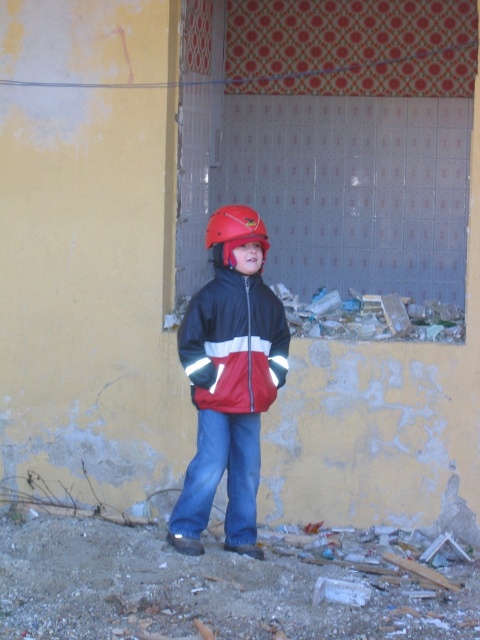
Question: Which of the following is the farthest from the observer?

Choices:
 (A) (214, 230)
 (B) (189, 316)
 (C) (223, 355)

Answer: (A)

Question: Is broken glass shards at lower center further to the viewer compared to matte red helmet at center?

Choices:
 (A) yes
 (B) no

Answer: (A)

Question: In this image, where is matte black jacket at center located relative to red matte jacket at center?

Choices:
 (A) below
 (B) above

Answer: (A)

Question: Is red matte jacket at center thinner than matte red helmet at center?

Choices:
 (A) yes
 (B) no

Answer: (B)

Question: Which of the following is the farthest from the observer?

Choices:
 (A) matte red helmet at center
 (B) broken glass shards at lower center
 (C) matte black jacket at center

Answer: (B)

Question: Which object is positioned closest to the matte red helmet at center?

Choices:
 (A) red matte jacket at center
 (B) broken glass shards at lower center
 (C) matte black jacket at center

Answer: (A)